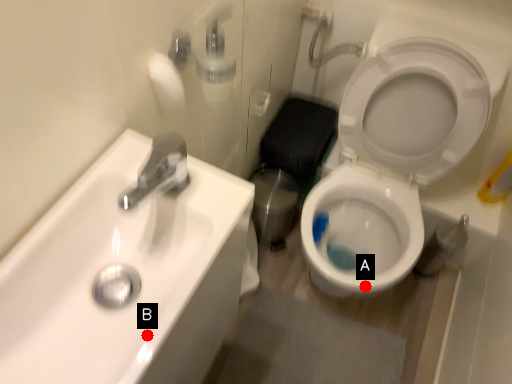
Question: Two points are circled on the image, labeled by A and B beside each circle. Which point is further to the camera?

Choices:
 (A) A is further
 (B) B is further

Answer: (A)